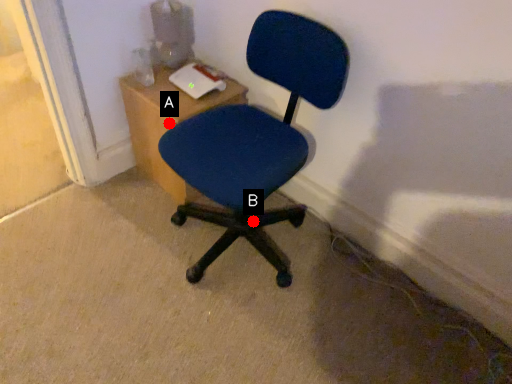
Question: Two points are circled on the image, labeled by A and B beside each circle. Which point is farther from the camera taking this photo?

Choices:
 (A) A is further
 (B) B is further

Answer: (B)